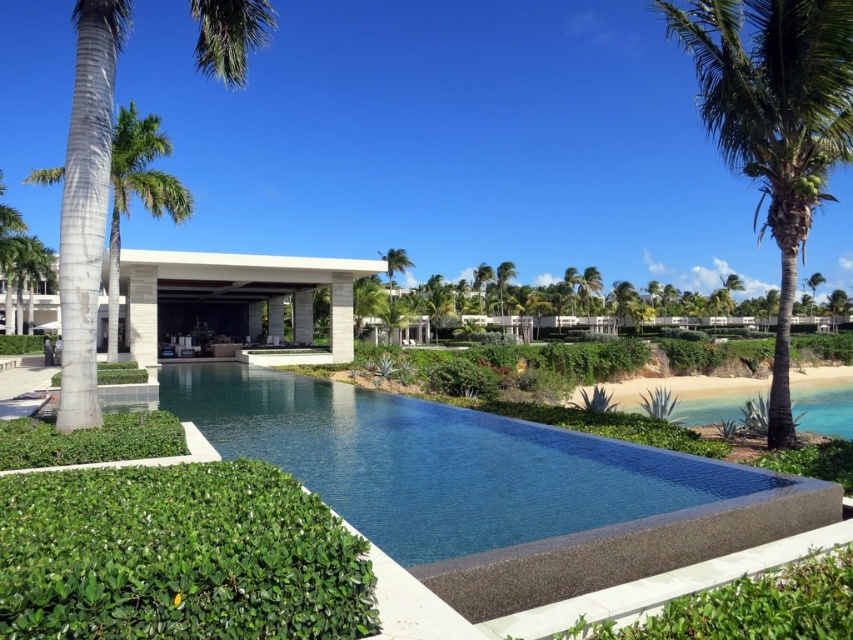
Can you confirm if green leafy hedge at lower left is positioned to the right of green leafy palm tree at right?

In fact, green leafy hedge at lower left is to the left of green leafy palm tree at right.

Who is positioned more to the right, green leafy hedge at lower left or green leafy palm tree at right?

green leafy palm tree at right

Locate an element on the screen. Image resolution: width=853 pixels, height=640 pixels. green leafy hedge at lower left is located at coordinates (178, 556).

Is green leafy hedge at lower left positioned before green leafy palm tree at left?

That is True.

Can you confirm if green leafy hedge at lower left is smaller than green leafy palm tree at left?

Correct, green leafy hedge at lower left occupies less space than green leafy palm tree at left.

The width and height of the screenshot is (853, 640). I want to click on green leafy hedge at lower left, so click(178, 556).

Consider the image. Does gray textured palm tree at left have a greater width compared to beige stone resort at center?

Incorrect, gray textured palm tree at left's width does not surpass beige stone resort at center's.

Can you confirm if gray textured palm tree at left is shorter than beige stone resort at center?

No.

The image size is (853, 640). I want to click on gray textured palm tree at left, so click(x=86, y=202).